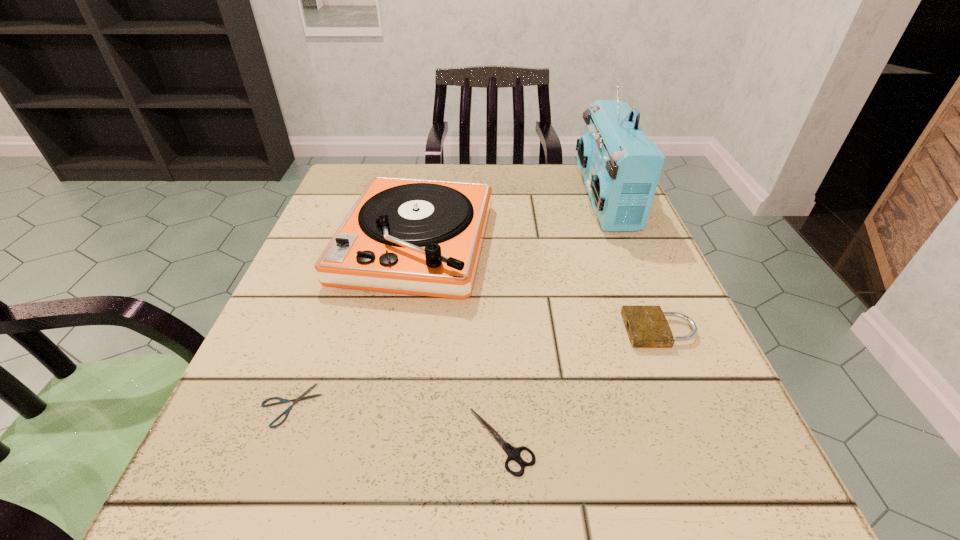
The height and width of the screenshot is (540, 960). I want to click on free spot located 0.230m on the front-facing side of the tallest object, so click(x=483, y=198).

This screenshot has height=540, width=960. What are the coordinates of `vacant space situated on the right of the second tallest object` in the screenshot? It's located at (621, 243).

Identify the location of vacant region located 0.220m on the keyhole side of the third tallest object. (490, 330).

The height and width of the screenshot is (540, 960). Identify the location of vacant space situated on the keyhole side of the third tallest object. (509, 330).

This screenshot has height=540, width=960. I want to click on vacant space located 0.080m on the keyhole side of the third tallest object, so click(577, 330).

Identify the location of vacant space located on the back of the right shears. (496, 310).

You are a GUI agent. You are given a task and a screenshot of the screen. Output one action in this format:
    pyautogui.click(x=<x>, y=<y>)
    Task: Click on the free space located 0.350m on the right of the shorter shears
    The width and height of the screenshot is (960, 540).
    Given the screenshot: What is the action you would take?
    pyautogui.click(x=574, y=405)

I want to click on radio receiver that is positioned at the far edge, so click(x=621, y=167).

The height and width of the screenshot is (540, 960). What are the coordinates of `record player situated at the far edge` in the screenshot? It's located at (421, 237).

Identify the location of object that is at the near edge. (513, 453).